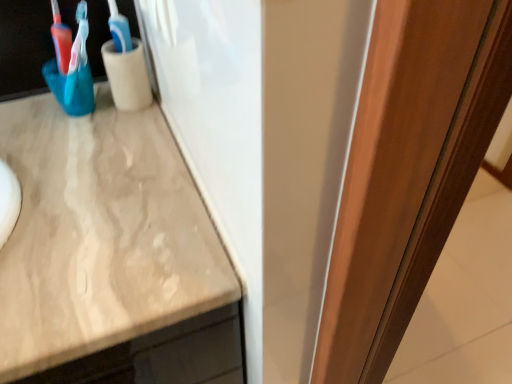
What do you see at coordinates (119, 29) in the screenshot?
I see `blue plastic toothbrush at upper left` at bounding box center [119, 29].

Where is `blue plastic toothbrush at upper left`? The height and width of the screenshot is (384, 512). blue plastic toothbrush at upper left is located at coordinates (119, 29).

Where is `smooth wooden door at right`? smooth wooden door at right is located at coordinates (409, 170).

This screenshot has width=512, height=384. What do you see at coordinates (409, 170) in the screenshot? I see `smooth wooden door at right` at bounding box center [409, 170].

The width and height of the screenshot is (512, 384). I want to click on blue plastic toothbrush at upper left, so click(x=119, y=29).

Between blue plastic toothbrush at upper left and smooth wooden door at right, which one appears on the right side from the viewer's perspective?

From the viewer's perspective, smooth wooden door at right appears more on the right side.

Which object is further away from the camera, blue plastic toothbrush at upper left or smooth wooden door at right?

blue plastic toothbrush at upper left.

Considering the points (118, 46) and (497, 73), which point is behind, point (118, 46) or point (497, 73)?

The point (118, 46) is farther from the camera.

From the image's perspective, which one is positioned lower, blue plastic toothbrush at upper left or smooth wooden door at right?

From the image's view, smooth wooden door at right is below.

From a real-world perspective, between blue plastic toothbrush at upper left and smooth wooden door at right, who is vertically higher?

In real-world perspective, blue plastic toothbrush at upper left is above.

Considering the sizes of objects blue plastic toothbrush at upper left and smooth wooden door at right in the image provided, who is thinner, blue plastic toothbrush at upper left or smooth wooden door at right?

blue plastic toothbrush at upper left is thinner.

Is blue plastic toothbrush at upper left shorter than smooth wooden door at right?

Indeed, blue plastic toothbrush at upper left has a lesser height compared to smooth wooden door at right.

Which of these two, blue plastic toothbrush at upper left or smooth wooden door at right, is smaller?

With smaller size is blue plastic toothbrush at upper left.

Is blue plastic toothbrush at upper left located outside smooth wooden door at right?

That's correct, blue plastic toothbrush at upper left is outside of smooth wooden door at right.

Is blue plastic toothbrush at upper left with smooth wooden door at right?

blue plastic toothbrush at upper left is not next to smooth wooden door at right, and they're not touching.

Is blue plastic toothbrush at upper left facing away from smooth wooden door at right?

No, blue plastic toothbrush at upper left's orientation is not away from smooth wooden door at right.

How many degrees apart are the facing directions of blue plastic toothbrush at upper left and smooth wooden door at right?

The angular difference between blue plastic toothbrush at upper left and smooth wooden door at right is 40.9 degrees.

Measure the distance from blue plastic toothbrush at upper left to smooth wooden door at right.

The distance of blue plastic toothbrush at upper left from smooth wooden door at right is 22.61 inches.

Locate an element on the screen. This screenshot has height=384, width=512. toothbrush above the smooth wooden door at right (from the image's perspective) is located at coordinates (119, 29).

Considering the relative positions of smooth wooden door at right and blue plastic toothbrush at upper left in the image provided, is smooth wooden door at right to the right of blue plastic toothbrush at upper left from the viewer's perspective?

Indeed, smooth wooden door at right is positioned on the right side of blue plastic toothbrush at upper left.

Who is more distant, smooth wooden door at right or blue plastic toothbrush at upper left?

blue plastic toothbrush at upper left is further away from the camera.

Is point (442, 198) closer or farther from the camera than point (118, 32)?

Point (442, 198) appears to be closer to the viewer than point (118, 32).

From the image's perspective, is smooth wooden door at right above or below blue plastic toothbrush at upper left?

smooth wooden door at right is below blue plastic toothbrush at upper left.

From a real-world perspective, is smooth wooden door at right under blue plastic toothbrush at upper left?

Yes, from a real-world perspective, smooth wooden door at right is beneath blue plastic toothbrush at upper left.

In the scene shown: Is smooth wooden door at right wider than blue plastic toothbrush at upper left?

Indeed, smooth wooden door at right has a greater width compared to blue plastic toothbrush at upper left.

Considering the sizes of objects smooth wooden door at right and blue plastic toothbrush at upper left in the image provided, who is shorter, smooth wooden door at right or blue plastic toothbrush at upper left?

With less height is blue plastic toothbrush at upper left.

Which of these two, smooth wooden door at right or blue plastic toothbrush at upper left, is bigger?

With larger size is smooth wooden door at right.

Is blue plastic toothbrush at upper left surrounded by smooth wooden door at right?

That's incorrect, blue plastic toothbrush at upper left is not inside smooth wooden door at right.

Is smooth wooden door at right touching blue plastic toothbrush at upper left?

They are not placed beside each other.

Does smooth wooden door at right turn towards blue plastic toothbrush at upper left?

No, smooth wooden door at right is not facing towards blue plastic toothbrush at upper left.

Measure the distance between smooth wooden door at right and blue plastic toothbrush at upper left.

22.61 inches.

Locate an element on the screen. toothbrush positioned vertically above the smooth wooden door at right (from a real-world perspective) is located at coordinates (119, 29).

This screenshot has width=512, height=384. What are the coordinates of `toothbrush above the smooth wooden door at right (from a real-world perspective)` in the screenshot? It's located at (119, 29).

Find the location of `toothbrush on the left side of smooth wooden door at right`. toothbrush on the left side of smooth wooden door at right is located at coordinates [119, 29].